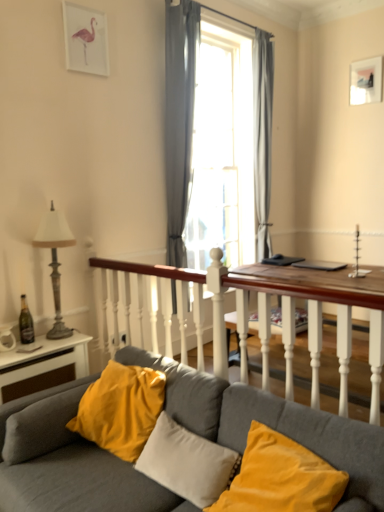
Question: Considering the relative sizes of velvet yellow pillow at center, which is the 1th pillow from left to right, and gray sheer curtain at center, marked as the 2th curtain in a right-to-left arrangement, in the image provided, is velvet yellow pillow at center, which is the 1th pillow from left to right, thinner than gray sheer curtain at center, marked as the 2th curtain in a right-to-left arrangement,?

Choices:
 (A) yes
 (B) no

Answer: (B)

Question: Is velvet yellow pillow at center, which is counted as the second pillow, starting from the right, located outside gray sheer curtain at center, the 2th curtain positioned from the back?

Choices:
 (A) no
 (B) yes

Answer: (B)

Question: Considering the relative sizes of velvet yellow pillow at center, which is counted as the second pillow, starting from the right, and gray sheer curtain at center, the 2th curtain positioned from the back, in the image provided, is velvet yellow pillow at center, which is counted as the second pillow, starting from the right, taller than gray sheer curtain at center, the 2th curtain positioned from the back,?

Choices:
 (A) yes
 (B) no

Answer: (B)

Question: Is velvet yellow pillow at center, which is the 1th pillow from left to right, positioned before gray sheer curtain at center, which is the 1th curtain from front to back?

Choices:
 (A) yes
 (B) no

Answer: (A)

Question: Does velvet yellow pillow at center, which is the 1th pillow from left to right, have a lesser height compared to gray sheer curtain at center, the 2th curtain positioned from the back?

Choices:
 (A) yes
 (B) no

Answer: (A)

Question: Is point (268, 161) closer or farther from the camera than point (145, 457)?

Choices:
 (A) closer
 (B) farther

Answer: (B)

Question: From a real-world perspective, is transparent glass window at center positioned above or below velvet yellow pillow at center, which is the 1th pillow from left to right?

Choices:
 (A) below
 (B) above

Answer: (B)

Question: In terms of size, does transparent glass window at center appear bigger or smaller than velvet yellow pillow at center, which is counted as the second pillow, starting from the right?

Choices:
 (A) big
 (B) small

Answer: (A)

Question: From the image's perspective, is transparent glass window at center located above or below velvet yellow pillow at center, which is counted as the second pillow, starting from the right?

Choices:
 (A) above
 (B) below

Answer: (A)

Question: Considering their positions, is gray sheer curtain at center, which is the 1th curtain from front to back, located in front of or behind transparent glass window at center?

Choices:
 (A) front
 (B) behind

Answer: (A)

Question: From a real-world perspective, is gray sheer curtain at center, arranged as the 1th curtain when viewed from the left, above or below transparent glass window at center?

Choices:
 (A) below
 (B) above

Answer: (B)

Question: Is gray sheer curtain at center, arranged as the 1th curtain when viewed from the left, wider or thinner than transparent glass window at center?

Choices:
 (A) wide
 (B) thin

Answer: (A)

Question: Would you say gray sheer curtain at center, marked as the 2th curtain in a right-to-left arrangement, is to the left or to the right of transparent glass window at center in the picture?

Choices:
 (A) left
 (B) right

Answer: (A)

Question: Looking at the image, does matte white picture frame at upper right seem bigger or smaller compared to gray sheer curtain at center, marked as the 2th curtain in a right-to-left arrangement?

Choices:
 (A) small
 (B) big

Answer: (A)

Question: Do you think matte white picture frame at upper right is within gray sheer curtain at center, the 2th curtain positioned from the back, or outside of it?

Choices:
 (A) inside
 (B) outside

Answer: (B)